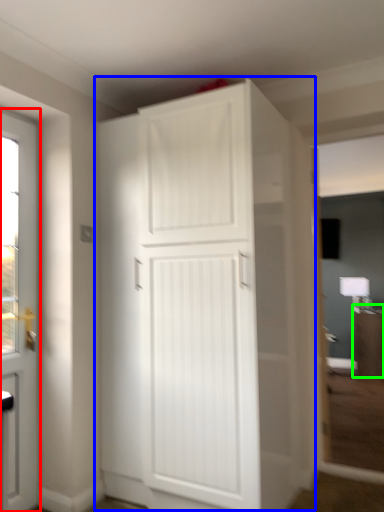
Question: Based on their relative distances, which object is farther from door (highlighted by a red box)? Choose from cupboard (highlighted by a blue box) and cabinetry (highlighted by a green box).

Choices:
 (A) cupboard
 (B) cabinetry

Answer: (B)